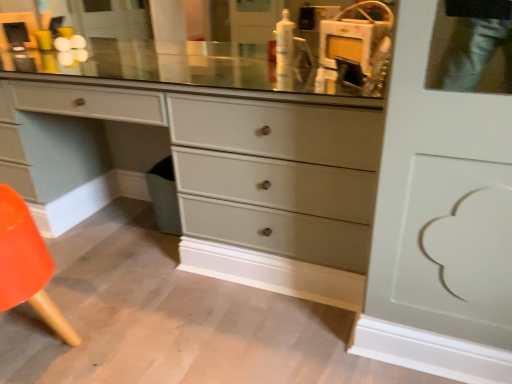
At what (x,y) coordinates should I click in order to perform the action: click on vacant space behind orange plastic chair at lower left. Please return your answer as a coordinate pair (x, y). This screenshot has height=384, width=512. Looking at the image, I should click on (97, 257).